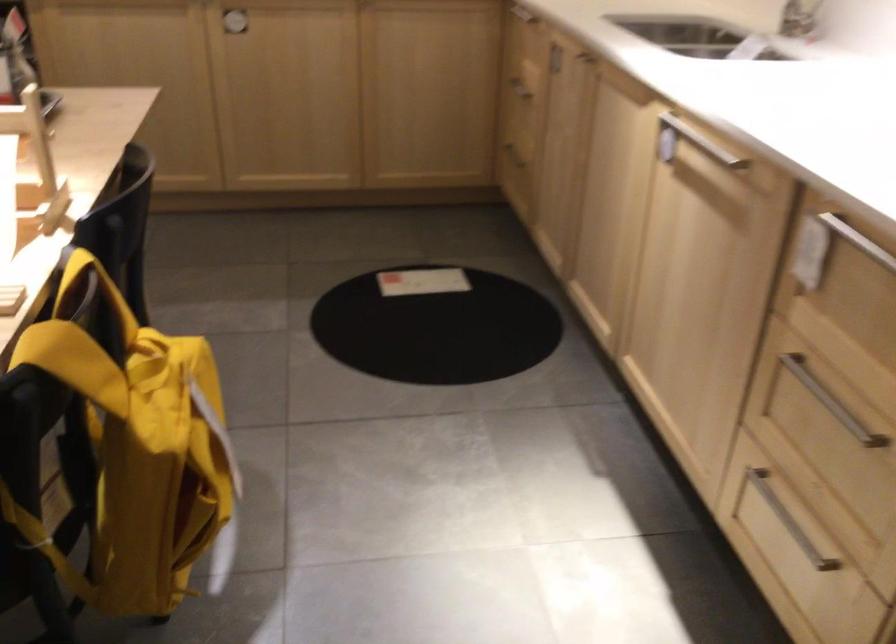
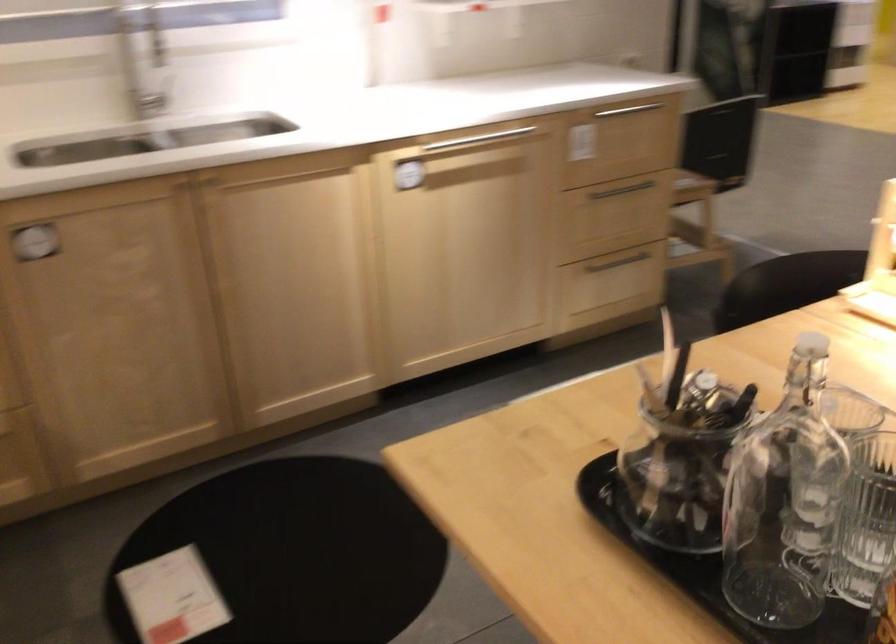
Find the pixel in the second image that matches the point at 701,138 in the first image.

(472, 140)